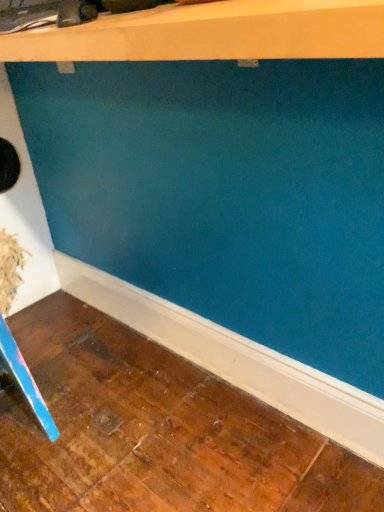
This screenshot has width=384, height=512. Identify the location of matte white shelf at upper center. 213,33.

The image size is (384, 512). What do you see at coordinates (213, 33) in the screenshot?
I see `matte white shelf at upper center` at bounding box center [213, 33].

Locate an element on the screen. This screenshot has width=384, height=512. blue plastic ruler at lower left is located at coordinates (25, 380).

Describe the element at coordinates (25, 380) in the screenshot. I see `blue plastic ruler at lower left` at that location.

This screenshot has height=512, width=384. I want to click on matte white shelf at upper center, so click(213, 33).

Consider the image. Between blue plastic ruler at lower left and matte white shelf at upper center, which one appears on the left side from the viewer's perspective?

Positioned to the left is blue plastic ruler at lower left.

Does blue plastic ruler at lower left lie behind matte white shelf at upper center?

Yes, it is behind matte white shelf at upper center.

Is point (26, 371) farther from viewer compared to point (98, 50)?

Yes.

From the image's perspective, would you say blue plastic ruler at lower left is positioned over matte white shelf at upper center?

Incorrect, from the image's perspective, blue plastic ruler at lower left is lower than matte white shelf at upper center.

From a real-world perspective, does blue plastic ruler at lower left sit lower than matte white shelf at upper center?

Yes.

Which of these two, blue plastic ruler at lower left or matte white shelf at upper center, is wider?

Wider between the two is matte white shelf at upper center.

Is blue plastic ruler at lower left shorter than matte white shelf at upper center?

In fact, blue plastic ruler at lower left may be taller than matte white shelf at upper center.

In the scene shown: Considering the sizes of blue plastic ruler at lower left and matte white shelf at upper center in the image, is blue plastic ruler at lower left bigger or smaller than matte white shelf at upper center?

Clearly, blue plastic ruler at lower left is smaller in size than matte white shelf at upper center.

Is blue plastic ruler at lower left not inside matte white shelf at upper center?

Yes, blue plastic ruler at lower left is located beyond the bounds of matte white shelf at upper center.

Is blue plastic ruler at lower left not near matte white shelf at upper center?

No.

Is blue plastic ruler at lower left aimed at matte white shelf at upper center?

No, blue plastic ruler at lower left is not oriented towards matte white shelf at upper center.

How many degrees apart are the facing directions of blue plastic ruler at lower left and matte white shelf at upper center?

There is a 0.602-degree angle between the facing directions of blue plastic ruler at lower left and matte white shelf at upper center.

Locate an element on the screen. shelf above the blue plastic ruler at lower left (from the image's perspective) is located at coordinates (213, 33).

Is matte white shelf at upper center to the left of blue plastic ruler at lower left from the viewer's perspective?

In fact, matte white shelf at upper center is to the right of blue plastic ruler at lower left.

Which is behind, matte white shelf at upper center or blue plastic ruler at lower left?

A: blue plastic ruler at lower left.

Is point (60, 42) in front of point (42, 401)?

Yes.

From the image's perspective, is matte white shelf at upper center positioned above or below blue plastic ruler at lower left?

matte white shelf at upper center is situated higher than blue plastic ruler at lower left in the image.

From a real-world perspective, is matte white shelf at upper center over blue plastic ruler at lower left?

Yes, from a real-world perspective, matte white shelf at upper center is over blue plastic ruler at lower left

In terms of width, does matte white shelf at upper center look wider or thinner when compared to blue plastic ruler at lower left?

Considering their sizes, matte white shelf at upper center looks broader than blue plastic ruler at lower left.

Can you confirm if matte white shelf at upper center is taller than blue plastic ruler at lower left?

No, matte white shelf at upper center is not taller than blue plastic ruler at lower left.

Who is smaller, matte white shelf at upper center or blue plastic ruler at lower left?

blue plastic ruler at lower left.

Is matte white shelf at upper center not within blue plastic ruler at lower left?

That's correct, matte white shelf at upper center is outside of blue plastic ruler at lower left.

Is matte white shelf at upper center touching blue plastic ruler at lower left?

They are not placed beside each other.

Does matte white shelf at upper center turn towards blue plastic ruler at lower left?

No, matte white shelf at upper center is not turned towards blue plastic ruler at lower left.

Identify the location of furniture on the left of matte white shelf at upper center. (25, 380).

Where is `shelf that is above the blue plastic ruler at lower left (from a real-world perspective)`? This screenshot has height=512, width=384. shelf that is above the blue plastic ruler at lower left (from a real-world perspective) is located at coordinates (213, 33).

Where is `furniture lying below the matte white shelf at upper center (from the image's perspective)`? Image resolution: width=384 pixels, height=512 pixels. furniture lying below the matte white shelf at upper center (from the image's perspective) is located at coordinates (25, 380).